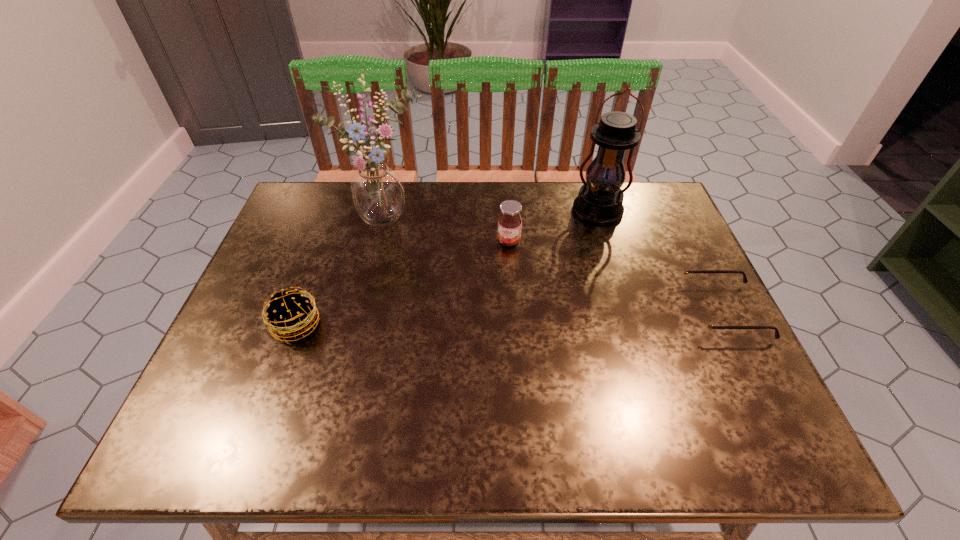
Locate an element on the screen. vacant space on the desktop that is between the patty and the spectacles and is positioned above the lantern, indicating its light source is located at coordinates (551, 317).

Identify the location of free spot on the desktop that is between the second shortest object and the rightmost object and is positioned on the label side of the jam. This screenshot has width=960, height=540. (484, 319).

What are the coordinates of `free space on the desktop that is between the second shortest object and the spectacles and is positioned on the front-facing side of the bouquet` in the screenshot? It's located at point(456,320).